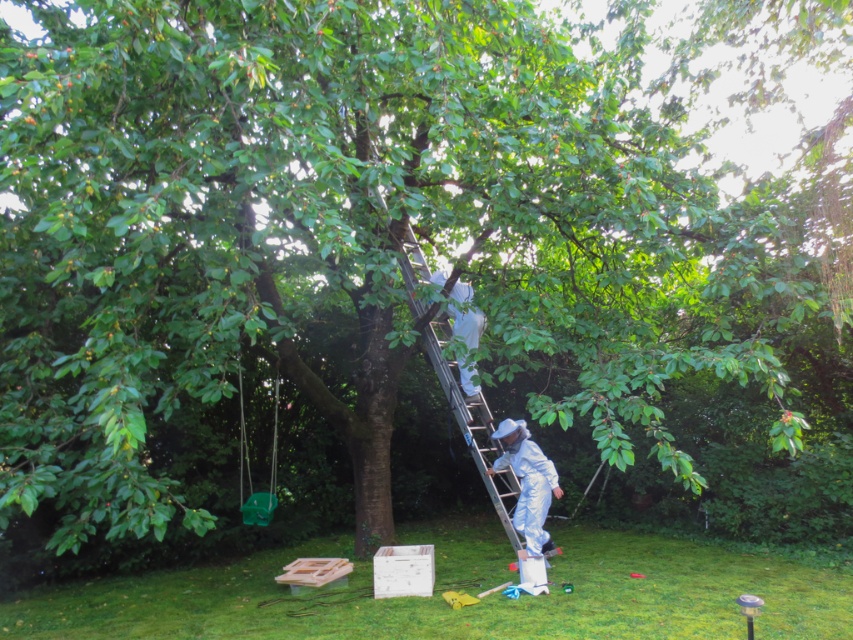
Question: Estimate the real-world distances between objects in this image. Which object is farther from the green plastic swing at lower left?

Choices:
 (A) white fabric at upper center
 (B) white fabric beekeeper suit at center

Answer: (B)

Question: Which of these objects is positioned closest to the silver metallic ladder at center?

Choices:
 (A) white fabric beekeeper suit at center
 (B) white fabric at upper center

Answer: (B)

Question: Does white fabric at upper center have a greater width compared to green plastic swing at lower left?

Choices:
 (A) yes
 (B) no

Answer: (A)

Question: Considering the relative positions of white fabric beekeeper suit at center and white fabric at upper center in the image provided, where is white fabric beekeeper suit at center located with respect to white fabric at upper center?

Choices:
 (A) left
 (B) right

Answer: (B)

Question: Is white fabric beekeeper suit at center further to camera compared to white fabric at upper center?

Choices:
 (A) yes
 (B) no

Answer: (B)

Question: Which object is farther from the camera taking this photo?

Choices:
 (A) silver metallic ladder at center
 (B) white fabric at upper center
 (C) white fabric beekeeper suit at center

Answer: (B)